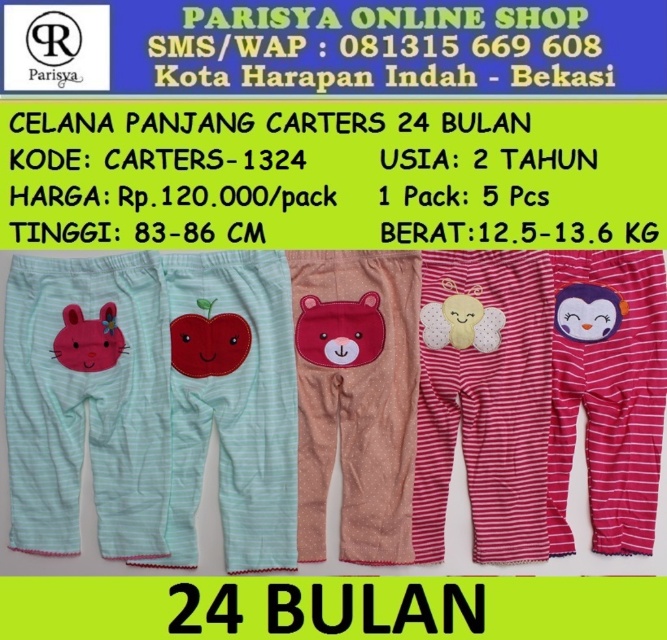
Question: Is pink velvety bear at center smaller than fluffy white bear at center?

Choices:
 (A) yes
 (B) no

Answer: (B)

Question: Which of the following is the closest to the observer?

Choices:
 (A) matte pink bunny at left
 (B) light green striped pants with rabbit appliqué at left

Answer: (B)

Question: Does light green striped pants with rabbit appliqué at left come in front of matte pink bunny at left?

Choices:
 (A) no
 (B) yes

Answer: (B)

Question: Estimate the real-world distances between objects in this image. Which object is closer to the light blue striped pants with apple applique at center?

Choices:
 (A) matte pink bunny at left
 (B) brown plush bear at center

Answer: (B)

Question: Which point appears closest to the camera in this image?

Choices:
 (A) (233, 362)
 (B) (462, 323)
 (C) (201, 445)

Answer: (C)

Question: Is striped cotton pants with bee applique at center smaller than purple plush penguin at center?

Choices:
 (A) yes
 (B) no

Answer: (B)